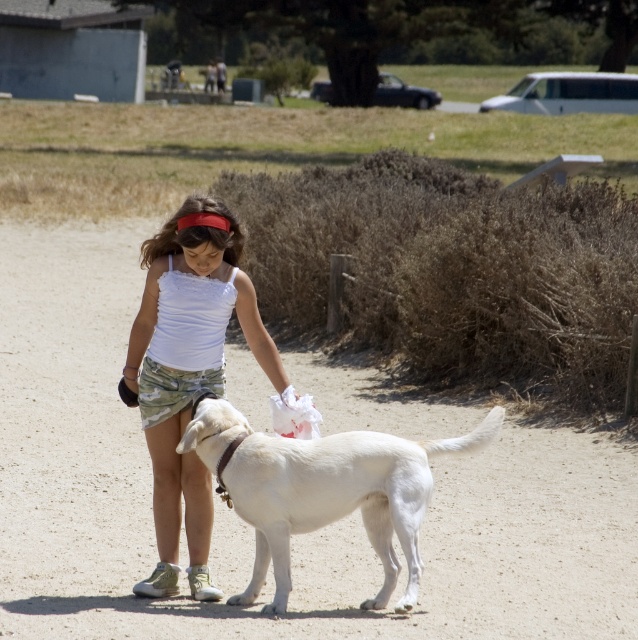
Question: Is dirt track at center closer to camera compared to white matte dog at center?

Choices:
 (A) no
 (B) yes

Answer: (B)

Question: Among these points, which one is nearest to the camera?

Choices:
 (A) pyautogui.click(x=179, y=472)
 (B) pyautogui.click(x=286, y=566)
 (C) pyautogui.click(x=54, y=316)

Answer: (B)

Question: Which point is closer to the camera taking this photo?

Choices:
 (A) (161, 268)
 (B) (375, 502)
 (C) (531, 532)

Answer: (A)

Question: Is dirt track at center to the left of white matte dog at center from the viewer's perspective?

Choices:
 (A) yes
 (B) no

Answer: (A)

Question: Is dirt track at center wider than white matte dog at center?

Choices:
 (A) no
 (B) yes

Answer: (B)

Question: Estimate the real-world distances between objects in this image. Which object is closer to the white cotton tank top at center?

Choices:
 (A) dirt track at center
 (B) white matte dog at center

Answer: (B)